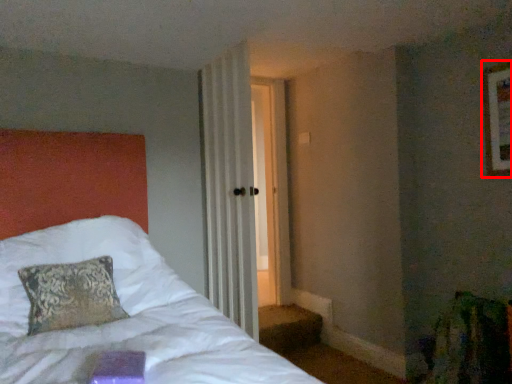
Question: From the image, what is the correct spatial relationship of picture frame (annotated by the red box) in relation to curtain?

Choices:
 (A) left
 (B) right

Answer: (B)